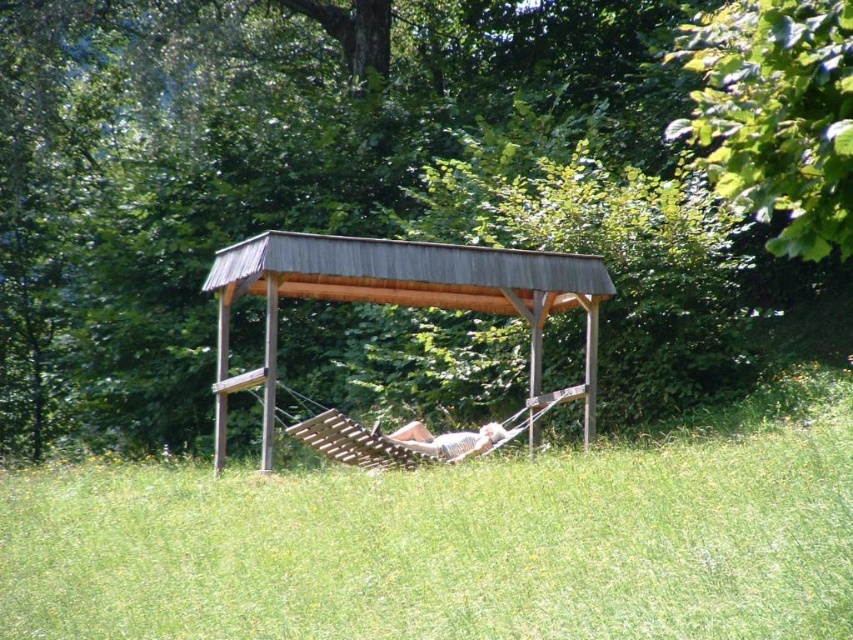
Question: Does green grass at center come behind green leafy tree at upper right?

Choices:
 (A) no
 (B) yes

Answer: (A)

Question: Which object is farther from the camera taking this photo?

Choices:
 (A) green leafy tree at upper center
 (B) green leafy tree at upper right

Answer: (A)

Question: Considering the relative positions of green leafy tree at upper right and light brown wooden hammock at center in the image provided, where is green leafy tree at upper right located with respect to light brown wooden hammock at center?

Choices:
 (A) below
 (B) above

Answer: (B)

Question: Which object appears farthest from the camera in this image?

Choices:
 (A) green leafy tree at upper right
 (B) green leafy tree at upper center
 (C) brown wooden gazebo at center
 (D) light brown wooden hammock at center

Answer: (D)

Question: Which point appears closest to the camera in this image?

Choices:
 (A) (155, 176)
 (B) (784, 472)
 (C) (471, 436)

Answer: (B)

Question: Does green leafy tree at upper right lie behind brown wooden gazebo at center?

Choices:
 (A) no
 (B) yes

Answer: (A)